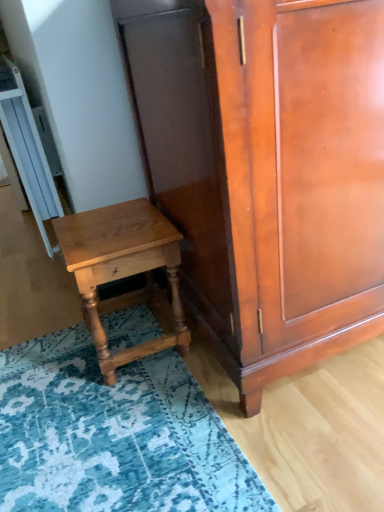
Identify the location of vacant region below light brown wood nightstand at lower left (from a real-world perspective). Image resolution: width=384 pixels, height=512 pixels. (140, 334).